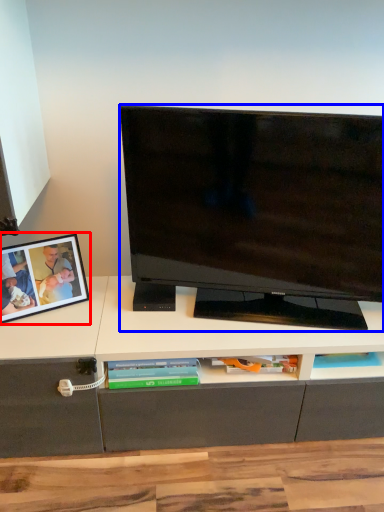
Question: Which object is closer to the camera taking this photo, picture frame (highlighted by a red box) or television (highlighted by a blue box)?

Choices:
 (A) picture frame
 (B) television

Answer: (B)